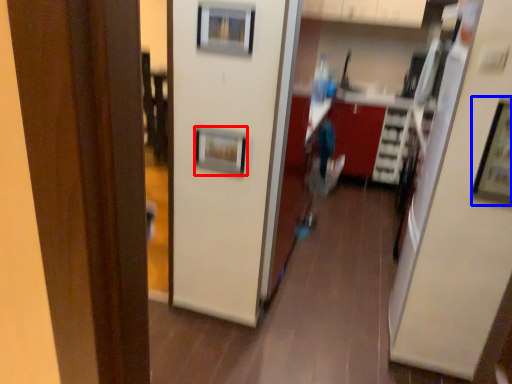
Question: Which point is closer to the camera, picture frame (highlighted by a red box) or picture frame (highlighted by a blue box)?

Choices:
 (A) picture frame
 (B) picture frame

Answer: (B)